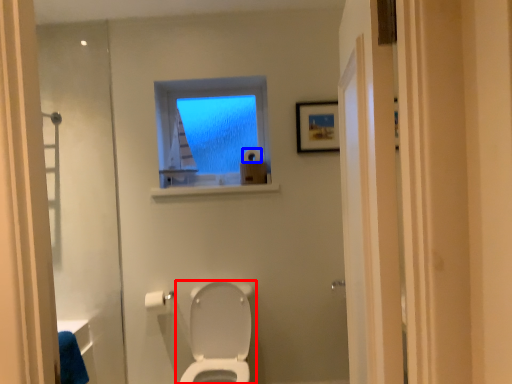
Question: Which point is further to the camera, toilet (highlighted by a red box) or toilet paper (highlighted by a blue box)?

Choices:
 (A) toilet
 (B) toilet paper

Answer: (B)